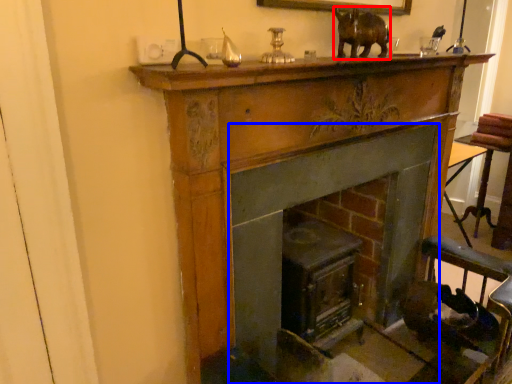
Question: Among these objects, which one is farthest to the camera, animal (highlighted by a red box) or fireplace (highlighted by a blue box)?

Choices:
 (A) animal
 (B) fireplace

Answer: (B)